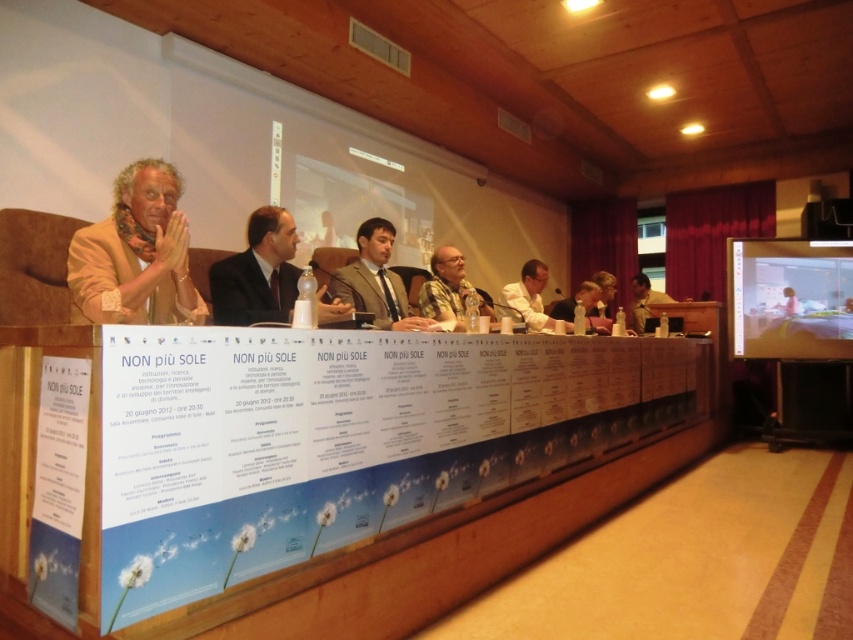
Question: Can you confirm if matte plastic projector screen at upper right is positioned to the left of patterned yellow shirt at center?

Choices:
 (A) yes
 (B) no

Answer: (B)

Question: Is golden textured jacket at left thinner than matte plastic projector screen at upper right?

Choices:
 (A) yes
 (B) no

Answer: (A)

Question: Can you confirm if golden textured jacket at left is smaller than dark gray suit at center?

Choices:
 (A) yes
 (B) no

Answer: (A)

Question: Considering the real-world distances, which object is closest to the light brown wooden chair at right?

Choices:
 (A) dark suit jacket at center
 (B) golden textured jacket at left

Answer: (A)

Question: Which object is positioned closest to the golden textured jacket at left?

Choices:
 (A) light brown wooden chair at right
 (B) dark suit jacket at center
 (C) patterned yellow shirt at center
 (D) dark gray suit at center

Answer: (B)

Question: Based on their relative distances, which object is farther from the golden textured jacket at left?

Choices:
 (A) dark gray suit at center
 (B) patterned yellow shirt at center
 (C) light brown wooden chair at right

Answer: (C)